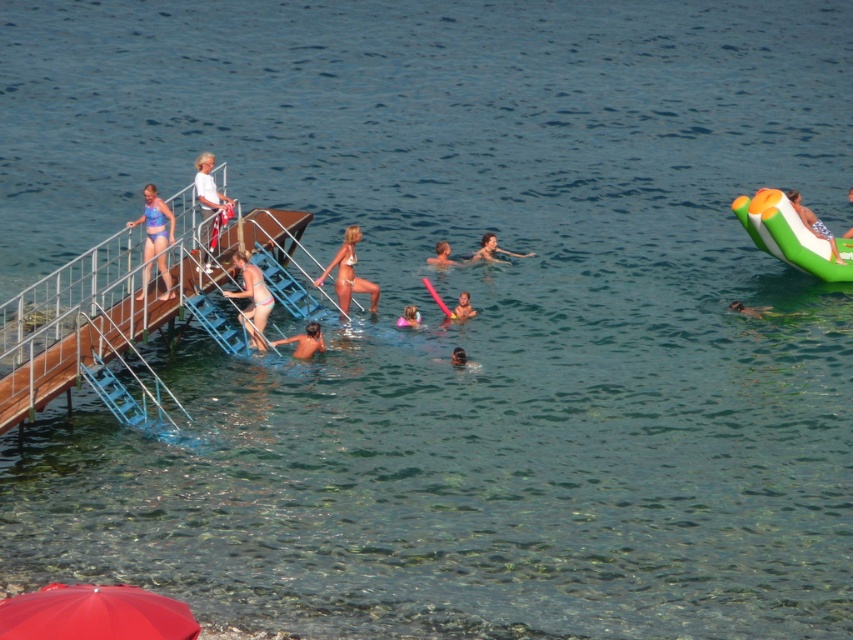
Can you confirm if light brown skin at lower center is positioned above light brown skin at center?

No.

Who is positioned more to the right, light brown skin at lower center or light brown skin at center?

light brown skin at center is more to the right.

Where is `light brown skin at lower center`? This screenshot has width=853, height=640. light brown skin at lower center is located at coordinates (305, 340).

Does matte white bikini at center have a greater width compared to smooth green float at upper right?

No, matte white bikini at center is not wider than smooth green float at upper right.

I want to click on matte white bikini at center, so click(x=347, y=273).

Is point (347, 237) in front of point (844, 234)?

That is True.

Locate an element on the screen. The image size is (853, 640). matte white bikini at center is located at coordinates (347, 273).

Does point (258, 289) lie behind point (485, 234)?

No, (258, 289) is in front of (485, 234).

Between light pink bikini at center and smooth skin woman at upper center, which one is positioned lower?

Positioned lower is light pink bikini at center.

Measure the distance between light pink bikini at center and camera.

light pink bikini at center is 29.57 meters away from camera.

Identify the location of light pink bikini at center. (252, 298).